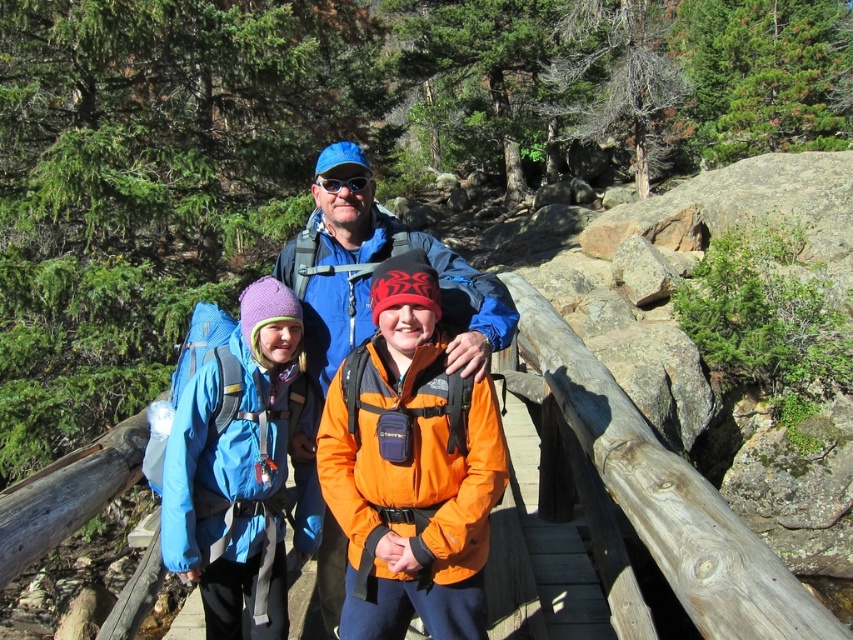
You are a GUI agent. You are given a task and a screenshot of the screen. Output one action in this format:
    pyautogui.click(x=<x>, y=<y>)
    Task: Click on the blue fabric backpack at center
    The image size is (853, 640).
    Given the screenshot: What is the action you would take?
    pyautogui.click(x=238, y=467)

Between point (303, 419) and point (494, 333), which one is positioned in front?

Point (494, 333) is more forward.

At what (x,y) coordinates should I click in order to perform the action: click on blue fabric backpack at center. Please return your answer as a coordinate pair (x, y). Image resolution: width=853 pixels, height=640 pixels. Looking at the image, I should click on pyautogui.click(x=238, y=467).